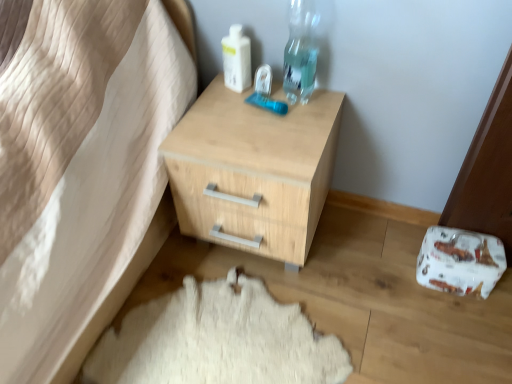
Identify the location of free space that is in between natural wood chest of drawers at center and white woolen rug at lower center. The image size is (512, 384). (324, 254).